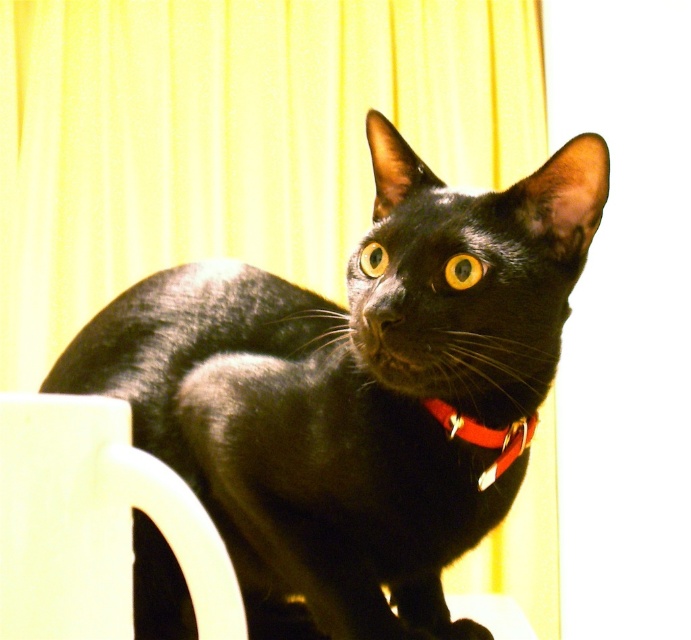
Question: Among these points, which one is farthest from the camera?

Choices:
 (A) (468, 419)
 (B) (583, 211)

Answer: (A)

Question: Can you confirm if shiny black cat at center is smaller than red leather collar at center?

Choices:
 (A) no
 (B) yes

Answer: (A)

Question: Does yellow fabric curtain at upper center appear over white matte mug at lower left?

Choices:
 (A) yes
 (B) no

Answer: (A)

Question: Which point appears closest to the camera in this image?

Choices:
 (A) click(x=115, y=493)
 (B) click(x=430, y=99)

Answer: (A)

Question: Estimate the real-world distances between objects in this image. Which object is closer to the red leather collar at center?

Choices:
 (A) white matte mug at lower left
 (B) shiny black cat at center

Answer: (B)

Question: Considering the relative positions of shiny black cat at center and red leather collar at center in the image provided, where is shiny black cat at center located with respect to red leather collar at center?

Choices:
 (A) below
 (B) above

Answer: (B)